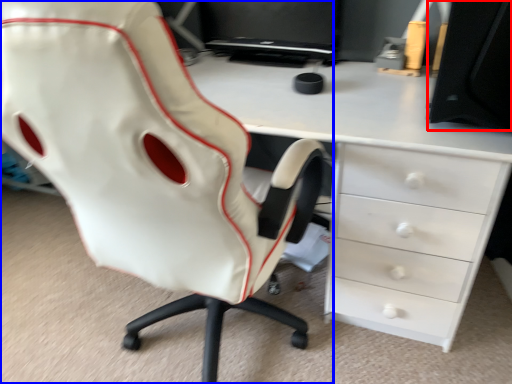
Question: Which point is further to the camera, desktop (highlighted by a red box) or chair (highlighted by a blue box)?

Choices:
 (A) desktop
 (B) chair

Answer: (A)